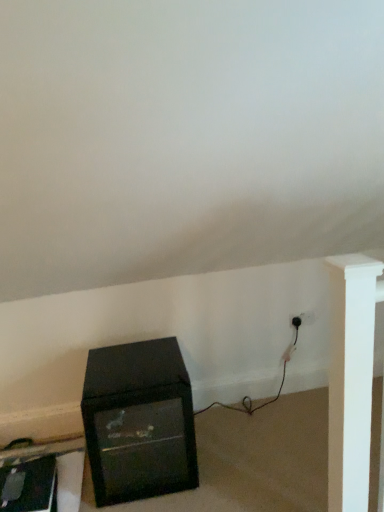
Question: Is the position of black plastic plug at lower right more distant than that of black glossy tv at lower left, which appears as the second furniture when viewed from the right?

Choices:
 (A) no
 (B) yes

Answer: (B)

Question: Could you tell me if black plastic plug at lower right is facing black glossy tv at lower left, which appears as the second furniture when viewed from the right?

Choices:
 (A) yes
 (B) no

Answer: (B)

Question: Considering the relative sizes of black plastic plug at lower right and black glossy tv at lower left, acting as the first furniture starting from the left, in the image provided, is black plastic plug at lower right shorter than black glossy tv at lower left, acting as the first furniture starting from the left,?

Choices:
 (A) yes
 (B) no

Answer: (A)

Question: Does black plastic plug at lower right lie in front of black glossy tv at lower left, which appears as the second furniture when viewed from the right?

Choices:
 (A) no
 (B) yes

Answer: (A)

Question: From a real-world perspective, is black plastic plug at lower right physically above black glossy tv at lower left, which appears as the second furniture when viewed from the right?

Choices:
 (A) no
 (B) yes

Answer: (B)

Question: From a real-world perspective, is black glossy tv at lower left, acting as the first furniture starting from the left, positioned above or below black plastic plug at lower right?

Choices:
 (A) above
 (B) below

Answer: (B)

Question: Based on their positions, is black glossy tv at lower left, acting as the first furniture starting from the left, located to the left or right of black plastic plug at lower right?

Choices:
 (A) left
 (B) right

Answer: (A)

Question: Considering their positions, is black glossy tv at lower left, acting as the first furniture starting from the left, located in front of or behind black plastic plug at lower right?

Choices:
 (A) behind
 (B) front

Answer: (B)

Question: Is black glossy tv at lower left, acting as the first furniture starting from the left, situated inside black plastic plug at lower right or outside?

Choices:
 (A) inside
 (B) outside

Answer: (B)

Question: In the image, is black plastic plug at lower right positioned in front of or behind black matte cabinet at lower left, which is the 2th furniture in left-to-right order?

Choices:
 (A) front
 (B) behind

Answer: (B)

Question: Do you think black plastic plug at lower right is within black matte cabinet at lower left, which appears as the 1th furniture when viewed from the right, or outside of it?

Choices:
 (A) outside
 (B) inside

Answer: (A)

Question: From their relative heights in the image, would you say black plastic plug at lower right is taller or shorter than black matte cabinet at lower left, which is the 2th furniture in left-to-right order?

Choices:
 (A) short
 (B) tall

Answer: (A)

Question: Visually, is black plastic plug at lower right positioned to the left or to the right of black matte cabinet at lower left, which appears as the 1th furniture when viewed from the right?

Choices:
 (A) left
 (B) right

Answer: (B)

Question: From a real-world perspective, is black glossy tv at lower left, which appears as the second furniture when viewed from the right, positioned above or below black matte cabinet at lower left, which appears as the 1th furniture when viewed from the right?

Choices:
 (A) above
 (B) below

Answer: (B)

Question: Relative to black matte cabinet at lower left, which appears as the 1th furniture when viewed from the right, is black glossy tv at lower left, which appears as the second furniture when viewed from the right, in front or behind?

Choices:
 (A) behind
 (B) front

Answer: (A)